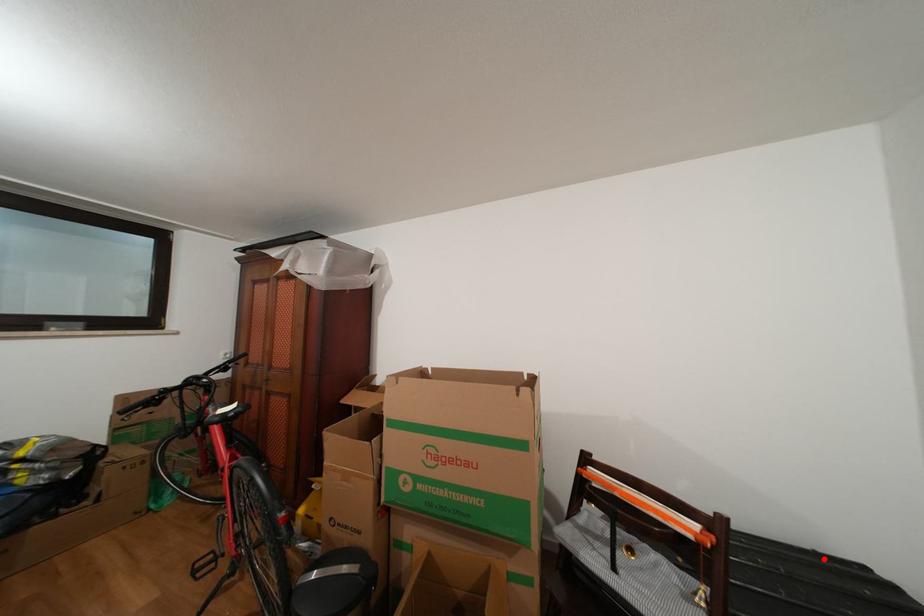
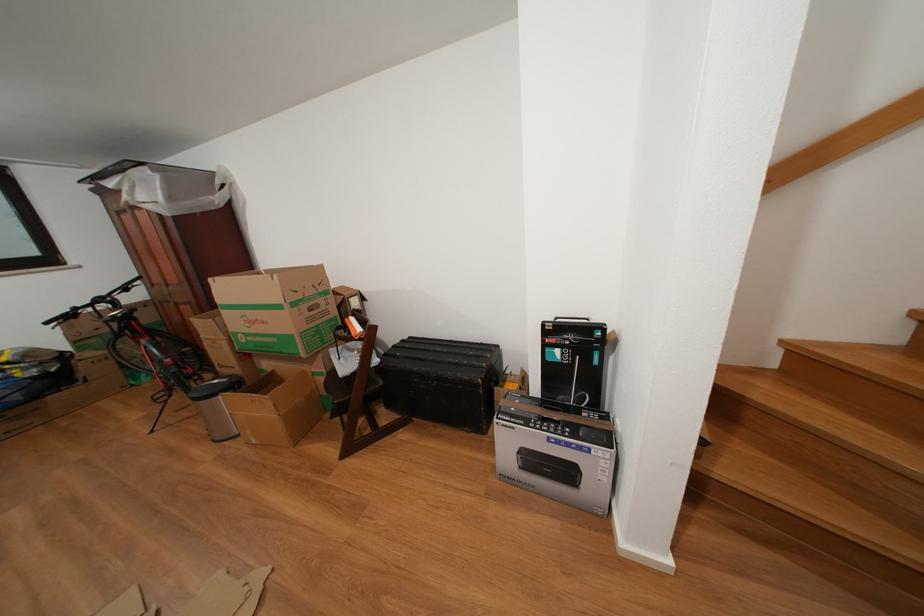
Where in the second image is the point corresponding to the highlighted location from the first image?

(490, 349)